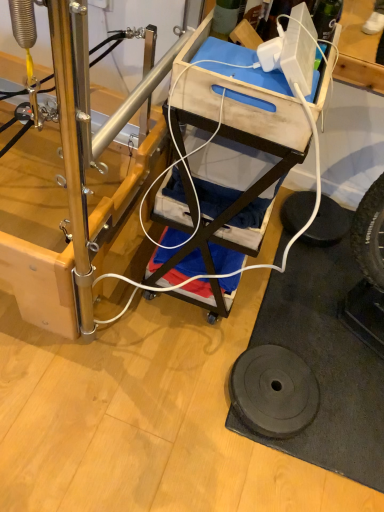
Identify the location of wooden cart at center. (244, 122).

Locate an element on the screen. This screenshot has width=384, height=512. black rubber weight at lower right is located at coordinates (273, 391).

Is black rubber tire at lower right further to camera compared to wooden cart at center?

Yes.

Which is nearer, (x=307, y=212) or (x=197, y=169)?

Point (x=307, y=212) is farther from the camera than point (x=197, y=169).

Considering the sizes of objects black rubber tire at lower right and wooden cart at center in the image provided, who is thinner, black rubber tire at lower right or wooden cart at center?

With smaller width is black rubber tire at lower right.

Could you tell me if black rubber tire at lower right is turned towards wooden cart at center?

No, black rubber tire at lower right is not turned towards wooden cart at center.

In the scene shown: Considering the sizes of wooden cart at center and black rubber tire at lower right in the image, is wooden cart at center bigger or smaller than black rubber tire at lower right?

Considering their sizes, wooden cart at center takes up more space than black rubber tire at lower right.

From a real-world perspective, does wooden cart at center stand above black rubber tire at lower right?

Yes, from a real-world perspective, wooden cart at center is on top of black rubber tire at lower right.

Visually, is wooden cart at center positioned to the left or to the right of black rubber tire at lower right?

From the image, it's evident that wooden cart at center is to the left of black rubber tire at lower right.

Which of these two, black rubber weight at lower right or wooden cart at center, stands shorter?

black rubber weight at lower right is shorter.

Considering the positions of objects black rubber weight at lower right and wooden cart at center in the image provided, who is behind, black rubber weight at lower right or wooden cart at center?

black rubber weight at lower right is further from the camera.

Could you tell me if black rubber weight at lower right is turned towards wooden cart at center?

No, black rubber weight at lower right is not oriented towards wooden cart at center.

Which is behind, point (282, 358) or point (293, 60)?

The point (282, 358) is farther.

Which of these two, black rubber tire at lower right or black rubber weight at lower right, is bigger?

Bigger between the two is black rubber weight at lower right.

Looking at their sizes, would you say black rubber tire at lower right is wider or thinner than black rubber weight at lower right?

Clearly, black rubber tire at lower right has less width compared to black rubber weight at lower right.

Based on the photo, is black rubber weight at lower right located within black rubber tire at lower right?

No, black rubber tire at lower right does not contain black rubber weight at lower right.

Which is more to the right, black rubber tire at lower right or black rubber weight at lower right?

Positioned to the right is black rubber tire at lower right.

Is black rubber weight at lower right to the right of black rubber tire at lower right from the viewer's perspective?

In fact, black rubber weight at lower right is to the left of black rubber tire at lower right.

Locate an element on the screen. The height and width of the screenshot is (512, 384). wheel above the black rubber tire at lower right (from a real-world perspective) is located at coordinates (273, 391).

Is black rubber weight at lower right turned away from black rubber tire at lower right?

Absolutely, black rubber weight at lower right is directed away from black rubber tire at lower right.

From a real-world perspective, is wooden cart at center under black rubber weight at lower right?

No.

Is wooden cart at center taller than black rubber weight at lower right?

Yes.

From the image's perspective, who appears lower, wooden cart at center or black rubber weight at lower right?

black rubber weight at lower right, from the image's perspective.

Who is smaller, wooden cart at center or black rubber weight at lower right?

black rubber weight at lower right.

Where is `tire behind the wooden cart at center`? tire behind the wooden cart at center is located at coordinates (327, 224).

I want to click on furniture lying on the left of black rubber tire at lower right, so click(244, 122).

From the image, which object appears to be nearer to wooden cart at center, black rubber weight at lower right or black rubber tire at lower right?

black rubber weight at lower right is closer to wooden cart at center.

Considering their positions, is black rubber tire at lower right positioned closer to black rubber weight at lower right than wooden cart at center?

wooden cart at center lies closer to black rubber weight at lower right than the other object.

Based on their spatial positions, is black rubber weight at lower right or wooden cart at center further from black rubber tire at lower right?

Among the two, wooden cart at center is located further to black rubber tire at lower right.

From the picture: Considering their positions, is wooden cart at center positioned closer to black rubber weight at lower right than black rubber tire at lower right?

Based on the image, wooden cart at center appears to be nearer to black rubber weight at lower right.

Estimate the real-world distances between objects in this image. Which object is further from wooden cart at center, black rubber tire at lower right or black rubber weight at lower right?

Among the two, black rubber tire at lower right is located further to wooden cart at center.

Which object lies further to the anchor point black rubber tire at lower right, wooden cart at center or black rubber weight at lower right?

wooden cart at center is positioned further to the anchor black rubber tire at lower right.

This screenshot has height=512, width=384. Find the location of `wheel between wooden cart at center and black rubber tire at lower right in the front-back direction`. wheel between wooden cart at center and black rubber tire at lower right in the front-back direction is located at coordinates (273, 391).